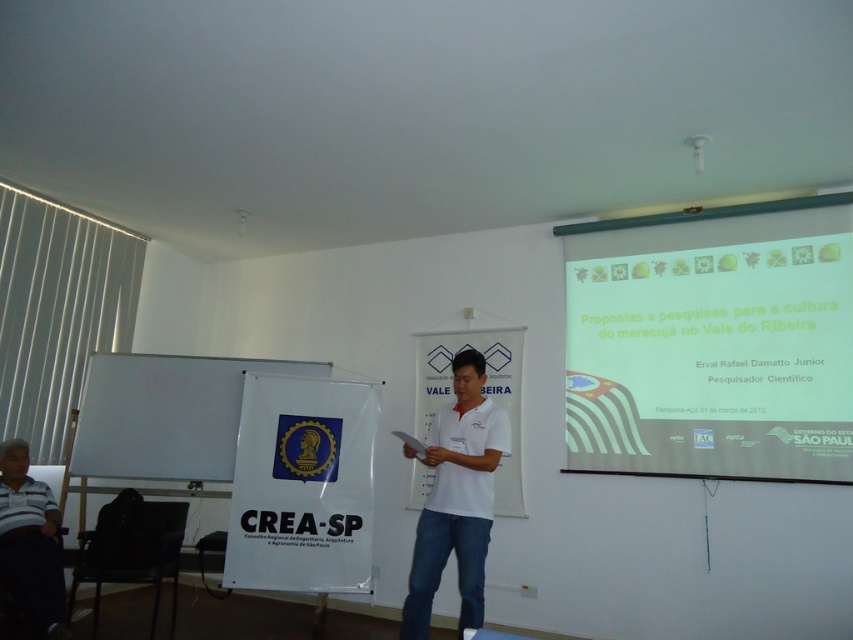
Is point (846, 304) closer to camera compared to point (473, 586)?

No, (846, 304) is further to viewer.

You are a GUI agent. You are given a task and a screenshot of the screen. Output one action in this format:
    pyautogui.click(x=<x>, y=<y>)
    Task: Click on the white matte projector screen at upper right
    
    Given the screenshot: What is the action you would take?
    pyautogui.click(x=712, y=362)

Who is positioned more to the right, white matte shirt at center or dark striped shirt at lower left?

white matte shirt at center is more to the right.

Is point (506, 451) less distant than point (21, 515)?

Yes, it is.

Which is in front, point (447, 556) or point (13, 499)?

Positioned in front is point (447, 556).

This screenshot has height=640, width=853. Identify the location of white matte shirt at center. (456, 497).

Does point (737, 300) come farther from viewer compared to point (27, 577)?

Yes, point (737, 300) is farther from viewer.

Can you confirm if white matte projector screen at upper right is positioned below dark striped shirt at lower left?

Actually, white matte projector screen at upper right is above dark striped shirt at lower left.

Does point (808, 300) come in front of point (9, 518)?

Yes, point (808, 300) is closer to viewer.

You are a GUI agent. You are given a task and a screenshot of the screen. Output one action in this format:
    pyautogui.click(x=<x>, y=<y>)
    Task: Click on the white matte projector screen at upper right
    The image size is (853, 640).
    Given the screenshot: What is the action you would take?
    [x=712, y=362]